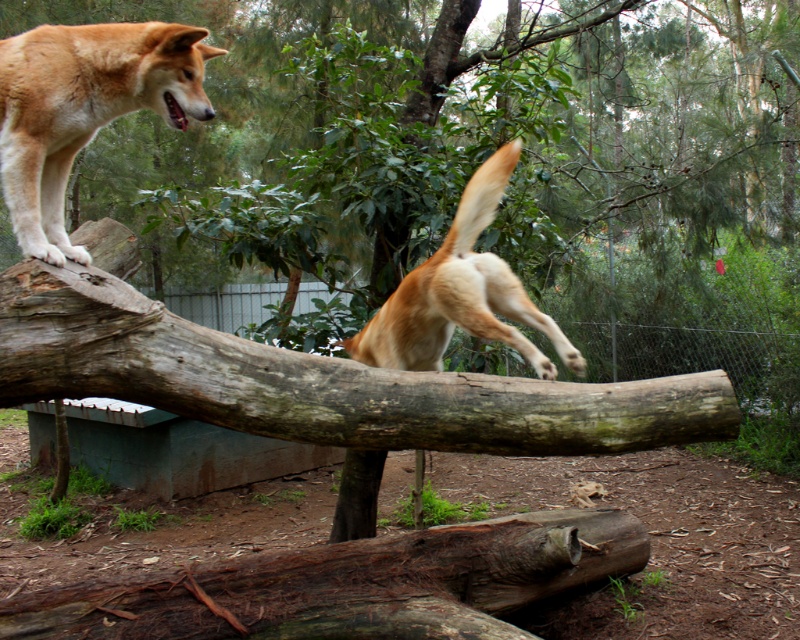
Question: Is golden fur dog at upper left further to camera compared to golden fur dog at center?

Choices:
 (A) no
 (B) yes

Answer: (B)

Question: Which of the following is the farthest from the observer?

Choices:
 (A) golden fur dog at upper left
 (B) rusty wooden log at lower center
 (C) golden fur dog at center

Answer: (B)

Question: Can you confirm if golden fur dog at upper left is smaller than golden fur dog at center?

Choices:
 (A) yes
 (B) no

Answer: (A)

Question: Estimate the real-world distances between objects in this image. Which object is farther from the golden fur dog at upper left?

Choices:
 (A) golden fur dog at center
 (B) rusty wooden log at lower center

Answer: (B)

Question: Does golden fur dog at upper left have a larger size compared to golden fur dog at center?

Choices:
 (A) no
 (B) yes

Answer: (A)

Question: Which of the following is the farthest from the observer?

Choices:
 (A) golden fur dog at upper left
 (B) golden fur dog at center

Answer: (A)